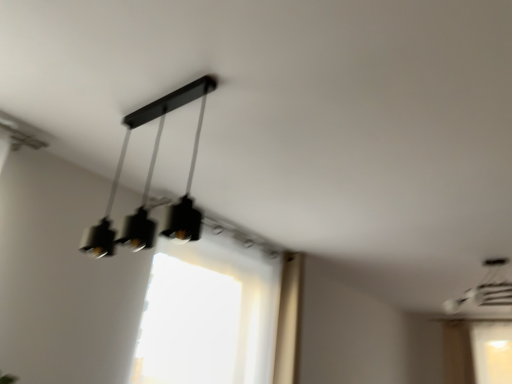
Where is `matte black pendant light at upper center, the 2th lamp in the bottom-to-top sequence`? The image size is (512, 384). matte black pendant light at upper center, the 2th lamp in the bottom-to-top sequence is located at coordinates (151, 161).

From a real-world perspective, which object rests below the other?

In real-world perspective, transparent fabric window at center is lower.

Is transparent fabric window at center smaller than matte black chandelier at upper right, which ranks as the first lamp in right-to-left order?

No, transparent fabric window at center is not smaller than matte black chandelier at upper right, which ranks as the first lamp in right-to-left order.

Could you tell me if transparent fabric window at center is facing matte black chandelier at upper right, marked as the second lamp in a top-to-bottom arrangement?

No, transparent fabric window at center is not turned towards matte black chandelier at upper right, marked as the second lamp in a top-to-bottom arrangement.

Between matte black chandelier at upper right, the 2th lamp in the front-to-back sequence, and transparent fabric window at center, which one has less height?

matte black chandelier at upper right, the 2th lamp in the front-to-back sequence.

Considering the relative sizes of matte black chandelier at upper right, marked as the second lamp in a top-to-bottom arrangement, and transparent fabric window at center in the image provided, is matte black chandelier at upper right, marked as the second lamp in a top-to-bottom arrangement, smaller than transparent fabric window at center?

Yes.

Is matte black chandelier at upper right, the first lamp when ordered from back to front, behind transparent fabric window at center?

Yes, matte black chandelier at upper right, the first lamp when ordered from back to front, is further from the viewer.

Would you say matte black pendant light at upper center, placed as the 2th lamp when sorted from right to left, is inside or outside transparent fabric window at center?

matte black pendant light at upper center, placed as the 2th lamp when sorted from right to left, lies outside transparent fabric window at center.

Is point (140, 223) positioned after point (209, 359)?

That is False.

Can you tell me how much matte black pendant light at upper center, which is the 2th lamp in back-to-front order, and transparent fabric window at center differ in facing direction?

They differ by 6.44e-05 degrees in their facing directions.

In the scene shown: From the image's perspective, is matte black pendant light at upper center, which is the 2th lamp in back-to-front order, located beneath transparent fabric window at center?

Actually, matte black pendant light at upper center, which is the 2th lamp in back-to-front order, appears above transparent fabric window at center in the image.

Based on the photo, considering the sizes of objects matte black pendant light at upper center, which is counted as the first lamp, starting from the top, and matte black chandelier at upper right, which is the second lamp from left to right, in the image provided, who is shorter, matte black pendant light at upper center, which is counted as the first lamp, starting from the top, or matte black chandelier at upper right, which is the second lamp from left to right,?

With less height is matte black chandelier at upper right, which is the second lamp from left to right.

Image resolution: width=512 pixels, height=384 pixels. Find the location of `lamp above the matte black pendant light at upper center, which is counted as the first lamp, starting from the top (from a real-world perspective)`. lamp above the matte black pendant light at upper center, which is counted as the first lamp, starting from the top (from a real-world perspective) is located at coordinates (485, 289).

From the image's perspective, is matte black pendant light at upper center, placed as the 2th lamp when sorted from right to left, positioned above or below matte black chandelier at upper right, which is counted as the first lamp, starting from the bottom?

Based on their image positions, matte black pendant light at upper center, placed as the 2th lamp when sorted from right to left, is located above matte black chandelier at upper right, which is counted as the first lamp, starting from the bottom.

Can matte black pendant light at upper center, marked as the 1th lamp in a left-to-right arrangement, be found inside transparent fabric window at center?

Actually, matte black pendant light at upper center, marked as the 1th lamp in a left-to-right arrangement, is outside transparent fabric window at center.

Is transparent fabric window at center thinner than matte black pendant light at upper center, which is the 2th lamp in back-to-front order?

Correct, the width of transparent fabric window at center is less than that of matte black pendant light at upper center, which is the 2th lamp in back-to-front order.

Find the location of a particular element. The image size is (512, 384). window below the matte black pendant light at upper center, marked as the 1th lamp in a left-to-right arrangement (from the image's perspective) is located at coordinates (208, 314).

From the image's perspective, which object appears higher, transparent fabric window at center or matte black pendant light at upper center, marked as the 1th lamp in a left-to-right arrangement?

matte black pendant light at upper center, marked as the 1th lamp in a left-to-right arrangement, from the image's perspective.

Relative to matte black pendant light at upper center, acting as the 1th lamp starting from the front, is matte black chandelier at upper right, which ranks as the first lamp in right-to-left order, in front or behind?

In the image, matte black chandelier at upper right, which ranks as the first lamp in right-to-left order, appears behind matte black pendant light at upper center, acting as the 1th lamp starting from the front.

Is matte black chandelier at upper right, the 2th lamp in the front-to-back sequence, facing towards matte black pendant light at upper center, placed as the 2th lamp when sorted from right to left?

No, matte black chandelier at upper right, the 2th lamp in the front-to-back sequence, is not aimed at matte black pendant light at upper center, placed as the 2th lamp when sorted from right to left.

Is matte black chandelier at upper right, which is counted as the first lamp, starting from the bottom, wider or thinner than matte black pendant light at upper center, acting as the 1th lamp starting from the front?

In the image, matte black chandelier at upper right, which is counted as the first lamp, starting from the bottom, appears to be more narrow than matte black pendant light at upper center, acting as the 1th lamp starting from the front.

Between matte black chandelier at upper right, marked as the second lamp in a top-to-bottom arrangement, and matte black pendant light at upper center, marked as the 1th lamp in a left-to-right arrangement, which one has larger size?

matte black chandelier at upper right, marked as the second lamp in a top-to-bottom arrangement, is bigger.

The image size is (512, 384). Find the location of `window in front of the matte black chandelier at upper right, which ranks as the first lamp in right-to-left order`. window in front of the matte black chandelier at upper right, which ranks as the first lamp in right-to-left order is located at coordinates (208, 314).

Where is `lamp on the right of transparent fabric window at center`? The height and width of the screenshot is (384, 512). lamp on the right of transparent fabric window at center is located at coordinates (485, 289).

Considering their positions, is transparent fabric window at center positioned further to matte black chandelier at upper right, the 2th lamp in the front-to-back sequence, than matte black pendant light at upper center, placed as the 2th lamp when sorted from right to left?

Among the two, matte black pendant light at upper center, placed as the 2th lamp when sorted from right to left, is located further to matte black chandelier at upper right, the 2th lamp in the front-to-back sequence.

Looking at the image, which one is located further to matte black pendant light at upper center, acting as the 1th lamp starting from the front, transparent fabric window at center or matte black chandelier at upper right, marked as the second lamp in a top-to-bottom arrangement?

Based on the image, matte black chandelier at upper right, marked as the second lamp in a top-to-bottom arrangement, appears to be further to matte black pendant light at upper center, acting as the 1th lamp starting from the front.

Based on their spatial positions, is matte black chandelier at upper right, which is the second lamp from left to right, or transparent fabric window at center further from matte black pendant light at upper center, acting as the 1th lamp starting from the front?

matte black chandelier at upper right, which is the second lamp from left to right, lies further to matte black pendant light at upper center, acting as the 1th lamp starting from the front, than the other object.

When comparing their distances from transparent fabric window at center, does matte black chandelier at upper right, the 2th lamp in the front-to-back sequence, or matte black pendant light at upper center, acting as the 1th lamp starting from the front, seem closer?

The object closer to transparent fabric window at center is matte black pendant light at upper center, acting as the 1th lamp starting from the front.

Considering their positions, is matte black pendant light at upper center, which is the 2th lamp in back-to-front order, positioned closer to matte black chandelier at upper right, which is the second lamp from left to right, than transparent fabric window at center?

transparent fabric window at center is closer to matte black chandelier at upper right, which is the second lamp from left to right.

When comparing their distances from transparent fabric window at center, does matte black pendant light at upper center, marked as the 1th lamp in a left-to-right arrangement, or matte black chandelier at upper right, which is counted as the first lamp, starting from the bottom, seem closer?

matte black pendant light at upper center, marked as the 1th lamp in a left-to-right arrangement, lies closer to transparent fabric window at center than the other object.

At what (x,y) coordinates should I click in order to perform the action: click on window between matte black pendant light at upper center, which is the 2th lamp in back-to-front order, and matte black chandelier at upper right, which is the second lamp from left to right, in the horizontal direction. Please return your answer as a coordinate pair (x, y). The width and height of the screenshot is (512, 384). Looking at the image, I should click on (208, 314).